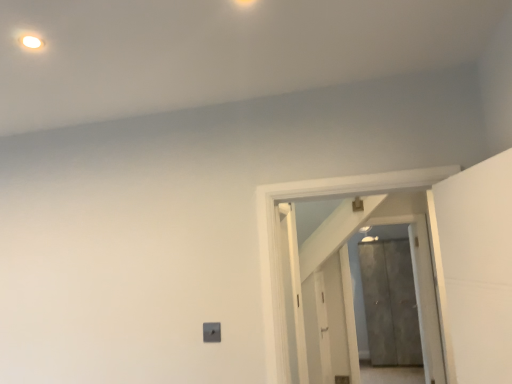
This screenshot has height=384, width=512. Describe the element at coordinates (390, 303) in the screenshot. I see `metallic gray door at center, which is counted as the second door, starting from the front` at that location.

You are a GUI agent. You are given a task and a screenshot of the screen. Output one action in this format:
    pyautogui.click(x=<x>, y=<y>)
    Task: Click on the metallic gray door at center, acting as the 1th door starting from the back
    
    Given the screenshot: What is the action you would take?
    pyautogui.click(x=390, y=303)

The image size is (512, 384). What do you see at coordinates (350, 286) in the screenshot?
I see `white wooden door at center, marked as the second door in a bottom-to-top arrangement` at bounding box center [350, 286].

Identify the location of white wooden door at center, the 1th door in the left-to-right sequence. (350, 286).

Locate an element on the screen. The image size is (512, 384). metallic gray door at center, which is the 1th door from right to left is located at coordinates (390, 303).

Considering the relative positions of metallic gray door at center, acting as the 1th door starting from the bottom, and white wooden door at center, the second door positioned from the back, in the image provided, is metallic gray door at center, acting as the 1th door starting from the bottom, to the left of white wooden door at center, the second door positioned from the back, from the viewer's perspective?

No.

Is the position of metallic gray door at center, acting as the 1th door starting from the back, less distant than that of white wooden door at center, the second door positioned from the back?

No, metallic gray door at center, acting as the 1th door starting from the back, is further to the viewer.

Which is closer, (404, 269) or (401, 193)?

Point (404, 269) appears to be farther away from the viewer than point (401, 193).

From the image's perspective, which object appears higher, metallic gray door at center, which is counted as the second door, starting from the front, or white wooden door at center, the 1th door in the left-to-right sequence?

white wooden door at center, the 1th door in the left-to-right sequence, appears higher in the image.

From the picture: From a real-world perspective, is metallic gray door at center, which is counted as the second door, starting from the front, beneath white wooden door at center, the second door positioned from the back?

Yes, from a real-world perspective, metallic gray door at center, which is counted as the second door, starting from the front, is under white wooden door at center, the second door positioned from the back.

Looking at this image, considering the relative sizes of metallic gray door at center, which is counted as the second door, starting from the front, and white wooden door at center, marked as the second door in a bottom-to-top arrangement, in the image provided, is metallic gray door at center, which is counted as the second door, starting from the front, thinner than white wooden door at center, marked as the second door in a bottom-to-top arrangement,?

Incorrect, the width of metallic gray door at center, which is counted as the second door, starting from the front, is not less than that of white wooden door at center, marked as the second door in a bottom-to-top arrangement.

Can you confirm if metallic gray door at center, marked as the second door in a top-to-bottom arrangement, is taller than white wooden door at center, which is counted as the 2th door, starting from the right?

→ Yes.

Can you confirm if metallic gray door at center, which is counted as the second door, starting from the front, is bigger than white wooden door at center, marked as the second door in a bottom-to-top arrangement?

Indeed, metallic gray door at center, which is counted as the second door, starting from the front, has a larger size compared to white wooden door at center, marked as the second door in a bottom-to-top arrangement.

Does metallic gray door at center, which is counted as the second door, starting from the front, contain white wooden door at center, which is counted as the 2th door, starting from the right?

No, white wooden door at center, which is counted as the 2th door, starting from the right, is located outside of metallic gray door at center, which is counted as the second door, starting from the front.

Is metallic gray door at center, acting as the 1th door starting from the back, far from white wooden door at center, the 1th door in the left-to-right sequence?

That's not correct — metallic gray door at center, acting as the 1th door starting from the back, is a little close to white wooden door at center, the 1th door in the left-to-right sequence.

Could you tell me if metallic gray door at center, which is counted as the second door, starting from the front, is turned towards white wooden door at center, acting as the first door starting from the top?

Yes, metallic gray door at center, which is counted as the second door, starting from the front, faces towards white wooden door at center, acting as the first door starting from the top.

How many degrees apart are the facing directions of metallic gray door at center, which is counted as the second door, starting from the front, and white wooden door at center, marked as the second door in a bottom-to-top arrangement?

There is a 0.805-degree angle between the facing directions of metallic gray door at center, which is counted as the second door, starting from the front, and white wooden door at center, marked as the second door in a bottom-to-top arrangement.

Measure the distance from metallic gray door at center, which is the 1th door from right to left, to white wooden door at center, marked as the second door in a bottom-to-top arrangement.

They are 32.79 inches apart.

Find the location of a particular element. Image resolution: width=512 pixels, height=384 pixels. door that appears above the metallic gray door at center, acting as the 1th door starting from the back (from a real-world perspective) is located at coordinates (350, 286).

Is white wooden door at center, acting as the first door starting from the top, to the left of metallic gray door at center, acting as the 1th door starting from the back, from the viewer's perspective?

Yes.

From the picture: Between white wooden door at center, which is counted as the 2th door, starting from the right, and metallic gray door at center, which is counted as the second door, starting from the front, which one is positioned in front?

white wooden door at center, which is counted as the 2th door, starting from the right, is more forward.

Is point (349, 334) behind point (373, 337)?

No, (349, 334) is closer to viewer.

From the image's perspective, would you say white wooden door at center, the 1th door in the left-to-right sequence, is shown under metallic gray door at center, acting as the 1th door starting from the back?

No, from the image's perspective, white wooden door at center, the 1th door in the left-to-right sequence, is not beneath metallic gray door at center, acting as the 1th door starting from the back.

In the scene shown: From a real-world perspective, is white wooden door at center, the second door positioned from the back, under metallic gray door at center, marked as the second door in a top-to-bottom arrangement?

No, from a real-world perspective, white wooden door at center, the second door positioned from the back, is not below metallic gray door at center, marked as the second door in a top-to-bottom arrangement.

Is white wooden door at center, the 1th door in the left-to-right sequence, thinner than metallic gray door at center, which is counted as the second door, starting from the front?

Correct, the width of white wooden door at center, the 1th door in the left-to-right sequence, is less than that of metallic gray door at center, which is counted as the second door, starting from the front.

Is white wooden door at center, acting as the first door starting from the top, shorter than metallic gray door at center, which is counted as the second door, starting from the front?

Yes.

Consider the image. Which of these two, white wooden door at center, acting as the 1th door starting from the front, or metallic gray door at center, which is counted as the second door, starting from the front, is bigger?

metallic gray door at center, which is counted as the second door, starting from the front.

Is metallic gray door at center, acting as the 1th door starting from the bottom, located within white wooden door at center, acting as the first door starting from the top?

No, metallic gray door at center, acting as the 1th door starting from the bottom, is located outside of white wooden door at center, acting as the first door starting from the top.

Is white wooden door at center, the 1th door in the left-to-right sequence, in contact with metallic gray door at center, which is the 1th door from right to left?

No, white wooden door at center, the 1th door in the left-to-right sequence, is not beside metallic gray door at center, which is the 1th door from right to left.

Is white wooden door at center, marked as the second door in a bottom-to-top arrangement, facing away from metallic gray door at center, which is the 1th door from right to left?

Yes.

The height and width of the screenshot is (384, 512). In the image, there is a white wooden door at center, marked as the second door in a bottom-to-top arrangement. In order to click on door below it (from the image's perspective) in this screenshot , I will do `click(390, 303)`.

Find the location of a particular element. door behind the white wooden door at center, the 1th door in the left-to-right sequence is located at coordinates (390, 303).

You are a GUI agent. You are given a task and a screenshot of the screen. Output one action in this format:
    pyautogui.click(x=<x>, y=<y>)
    Task: Click on the door that appears on the left of metallic gray door at center, acting as the 1th door starting from the back
    This screenshot has width=512, height=384.
    Given the screenshot: What is the action you would take?
    pyautogui.click(x=350, y=286)